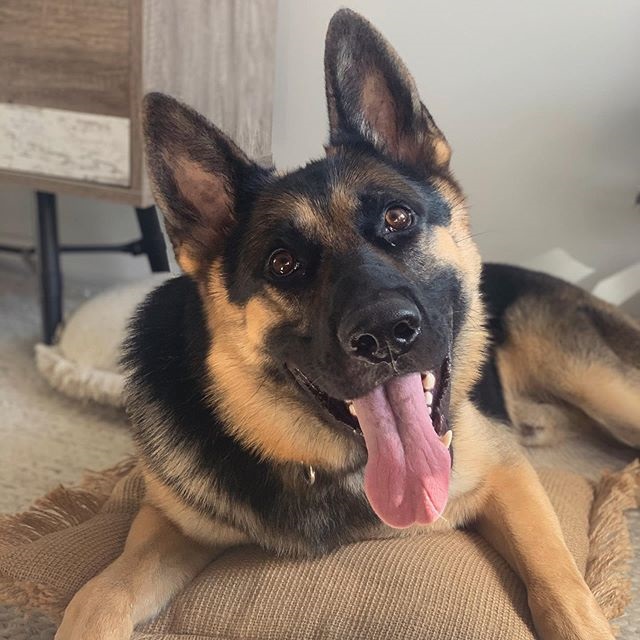
Where is `tan carpet`? The height and width of the screenshot is (640, 640). tan carpet is located at coordinates (58, 452).